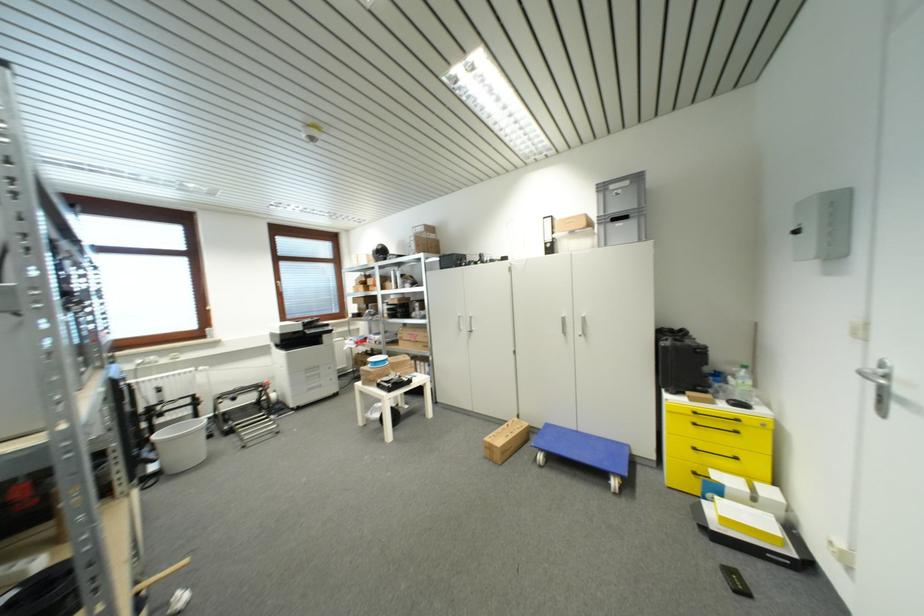
Identify the location of silver door handle. (879, 386).